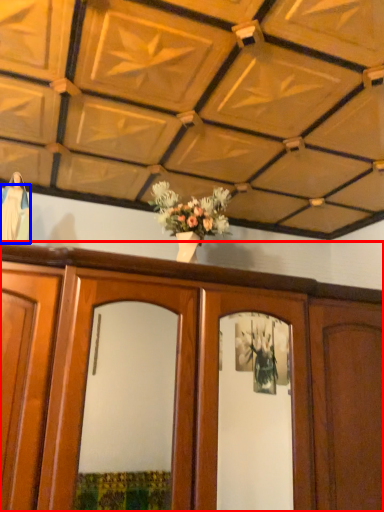
Question: Among these objects, which one is farthest to the camera, cabinetry (highlighted by a red box) or robe (highlighted by a blue box)?

Choices:
 (A) cabinetry
 (B) robe

Answer: (B)